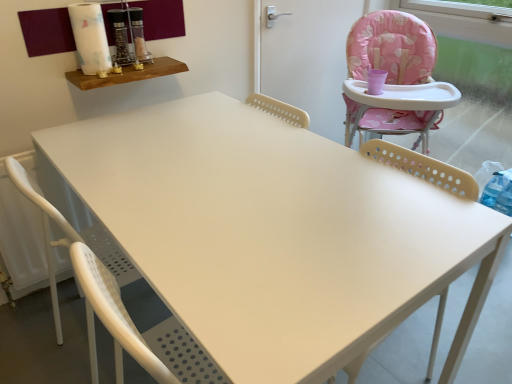
I want to click on free space above wooden shelf at upper left (from a real-world perspective), so point(134,65).